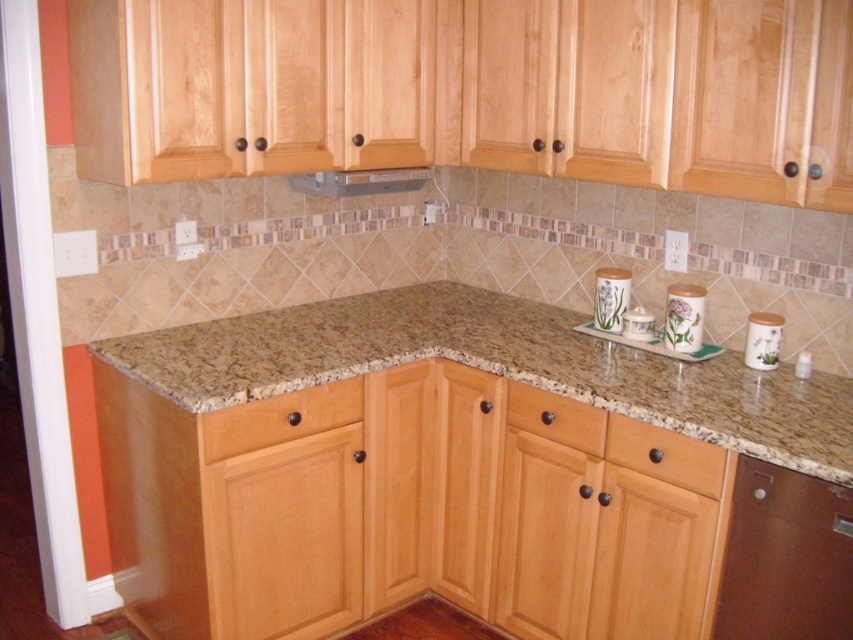
You are organizing the kitchen and need to place a new appliance. The brown matte dishwasher at lower right and the matte wood drawer at lower left are in your way. Which one is closer to the floor?

The brown matte dishwasher at lower right is closer to the floor since it is below the matte wood drawer at lower left.

You are organizing items on the kitchen countertop and need to place a spice jar between the brown matte drawer at lower center and the matte wood drawer at center. Based on their positions, which drawer should the spice jar be closer to?

The brown matte drawer at lower center is to the right of the matte wood drawer at center, so the spice jar should be placed closer to the brown matte drawer at lower center to be between them.

You are standing in the kitchen and want to reach the point at coordinates point (x=773, y=608). Considering the countertop is 3.5 feet high, can you comfortably reach it without a stool?

The point (x=773, y=608) is 5.86 feet away from the viewer. Since the countertop is 3.5 feet high, the distance from the viewer to the point does not affect the height required to reach it. Comfortable reaching height for most adults is typically up to 7 feet, so 3.5 feet is within comfortable reach.